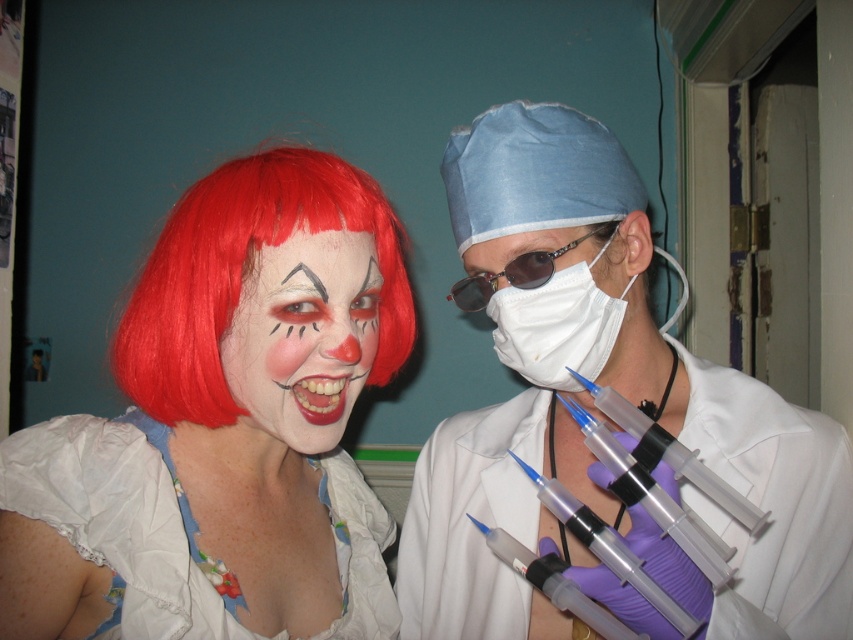
Between red synthetic wig at left and transparent plastic syringes at lower right, which one appears on the right side from the viewer's perspective?

Positioned to the right is transparent plastic syringes at lower right.

Which is below, red synthetic wig at left or transparent plastic syringes at lower right?

transparent plastic syringes at lower right is lower down.

Which is in front, point (212, 360) or point (628, 566)?

Positioned in front is point (628, 566).

You are a GUI agent. You are given a task and a screenshot of the screen. Output one action in this format:
    pyautogui.click(x=<x>, y=<y>)
    Task: Click on the red synthetic wig at left
    
    Given the screenshot: What is the action you would take?
    pyautogui.click(x=244, y=276)

Is white floral fabric dress at lower left to the right of transparent plastic syringes at center from the viewer's perspective?

In fact, white floral fabric dress at lower left is to the left of transparent plastic syringes at center.

Who is more forward, (361,544) or (686,461)?

Point (686,461)

The height and width of the screenshot is (640, 853). Identify the location of white floral fabric dress at lower left. (122, 522).

Is white floral fabric dress at lower left shorter than red synthetic wig at left?

Yes, white floral fabric dress at lower left is shorter than red synthetic wig at left.

Consider the image. Who is more distant from viewer, (123, 426) or (165, 403)?

Positioned behind is point (123, 426).

Find the location of a particular element. white floral fabric dress at lower left is located at coordinates (122, 522).

The image size is (853, 640). Find the location of `white floral fabric dress at lower left`. white floral fabric dress at lower left is located at coordinates tap(122, 522).